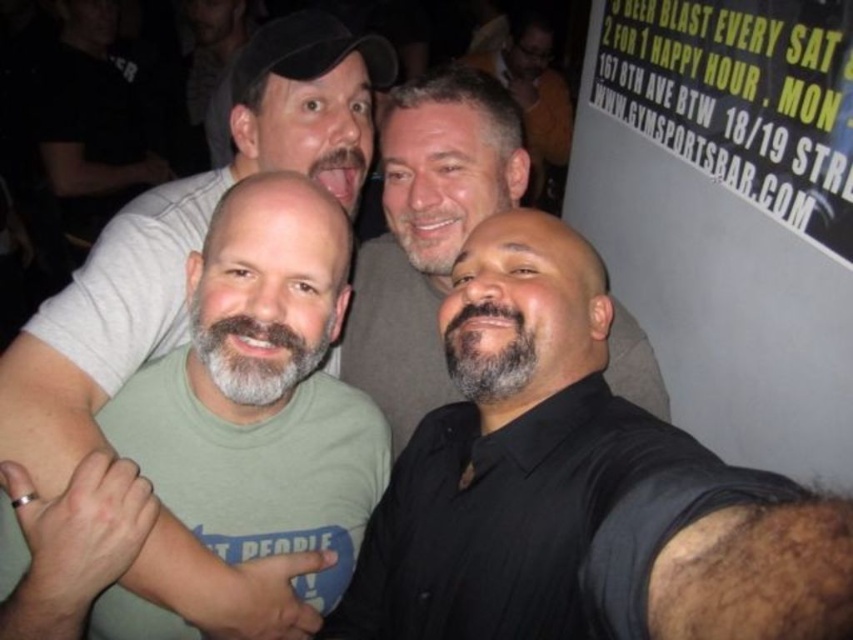
You are a photographer trying to capture the scene. You want to ensure that both the black plastic signboard at upper right and the gray beard at center are clearly visible in your shot. Which object should you focus on first to ensure both are in frame?

The black plastic signboard at upper right is positioned on the right side of gray beard at center. To ensure both are in frame, focus on the gray beard at center first as it is centrally located, then adjust to include the signboard on its right.

In the image of the four men taking a selfie, which object is positioned to the right of the other between the black shirt at center and the gray beard at center?

The black shirt at center is positioned to the right of the gray beard at center according to the description.

In the image of the group selfie, there are two men at the center wearing a black shirt at center and having a gray beard at center. Which one is closer to the camera?

The black shirt at center is closer to the camera because it is in front of the gray beard at center.